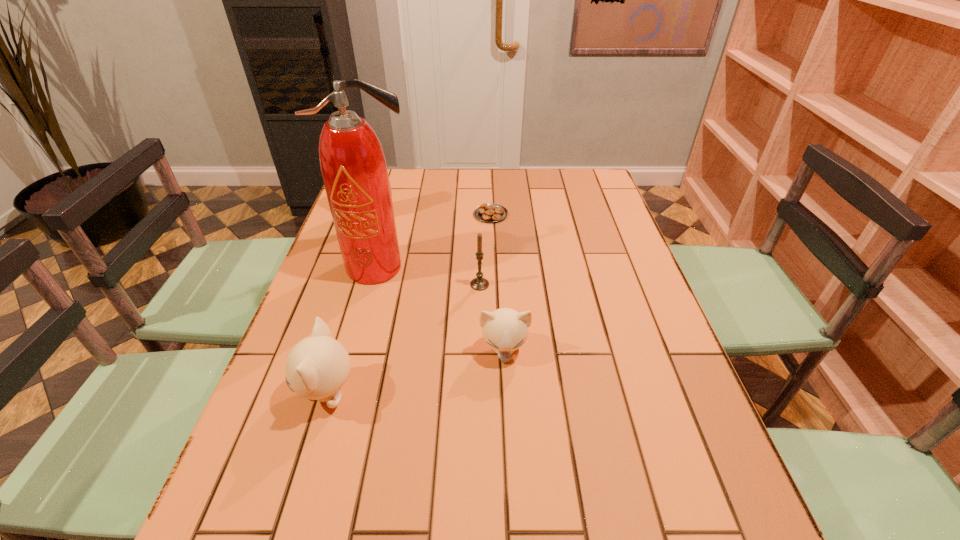
This screenshot has width=960, height=540. Identify the location of vacant space located on the front-facing side of the second tallest object. (363, 241).

Locate an element on the screen. free region located on the back of the candle is located at coordinates (480, 207).

Image resolution: width=960 pixels, height=540 pixels. Identify the location of kitten located in the left edge section of the desktop. (318, 366).

Where is `fire extinguisher that is at the left edge`? This screenshot has width=960, height=540. fire extinguisher that is at the left edge is located at coordinates (353, 166).

What are the coordinates of `detergent positioned at the left edge` in the screenshot? It's located at (389, 180).

The image size is (960, 540). I want to click on vacant position at the far edge of the desktop, so click(x=459, y=177).

Where is `vacant region at the near edge of the desktop`? Image resolution: width=960 pixels, height=540 pixels. vacant region at the near edge of the desktop is located at coordinates (491, 480).

Locate an element on the screen. vacant space at the left edge of the desktop is located at coordinates (363, 302).

You are a GUI agent. You are given a task and a screenshot of the screen. Output one action in this format:
    pyautogui.click(x=<x>, y=<y>)
    Task: Click on the vacant area at the right edge
    The width and height of the screenshot is (960, 540).
    Given the screenshot: What is the action you would take?
    pyautogui.click(x=614, y=350)

Image resolution: width=960 pixels, height=540 pixels. What are the coordinates of `free space at the far right corner of the desktop` in the screenshot? It's located at (576, 193).